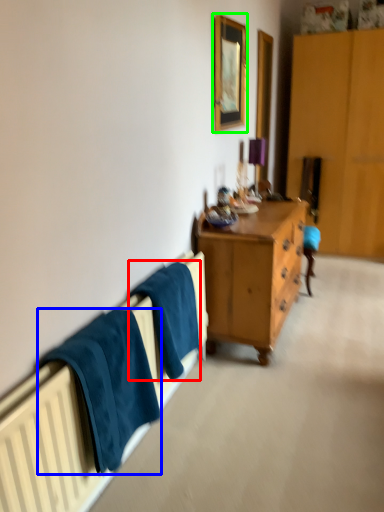
Question: Estimate the real-world distances between objects in this image. Which object is closer to bath towel (highlighted by a red box), towel/napkin (highlighted by a blue box) or picture frame (highlighted by a green box)?

Choices:
 (A) towel/napkin
 (B) picture frame

Answer: (A)